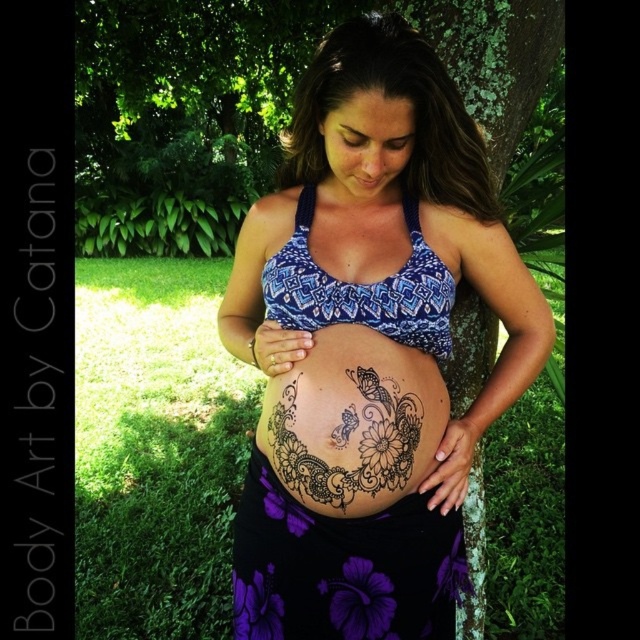
Question: Is matte blue bikini top at center wider than black henna tattoo at center?

Choices:
 (A) no
 (B) yes

Answer: (B)

Question: Which object is closer to the camera taking this photo?

Choices:
 (A) matte blue bikini top at center
 (B) black henna tattoo at center

Answer: (A)

Question: Does matte blue bikini top at center appear on the left side of black henna tattoo at center?

Choices:
 (A) yes
 (B) no

Answer: (B)

Question: Is matte blue bikini top at center to the left of black henna tattoo at center from the viewer's perspective?

Choices:
 (A) yes
 (B) no

Answer: (B)